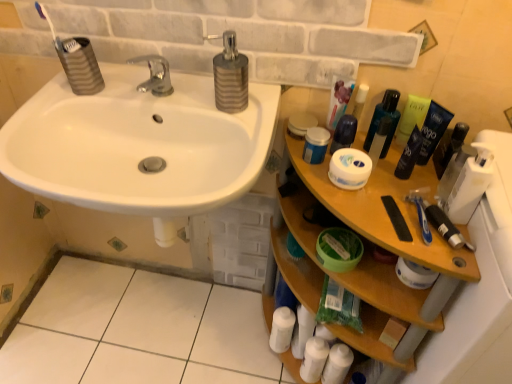
Identify the location of blank area to the left of blue plastic toothbrush at right, the 2th toothbrush positioned from the top. The height and width of the screenshot is (384, 512). (368, 209).